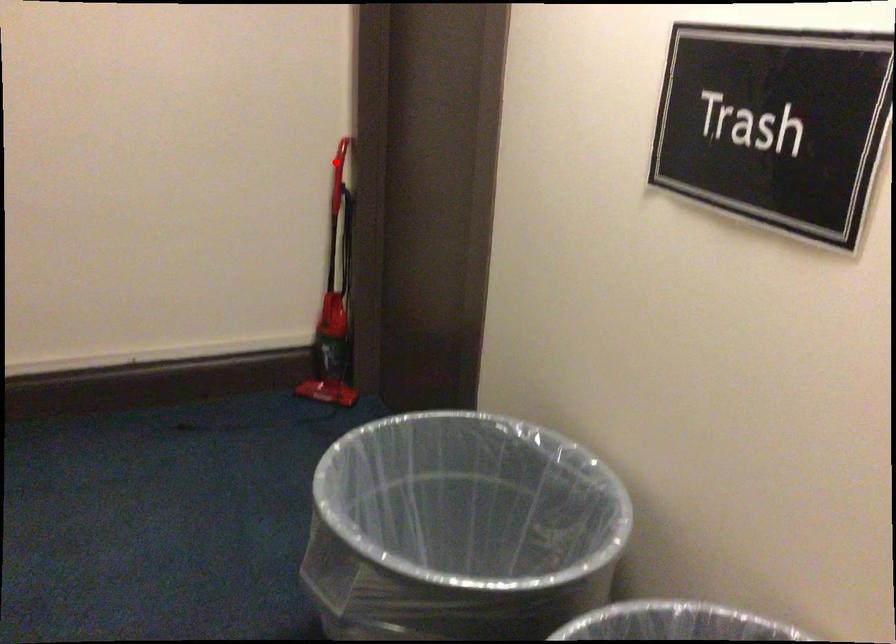
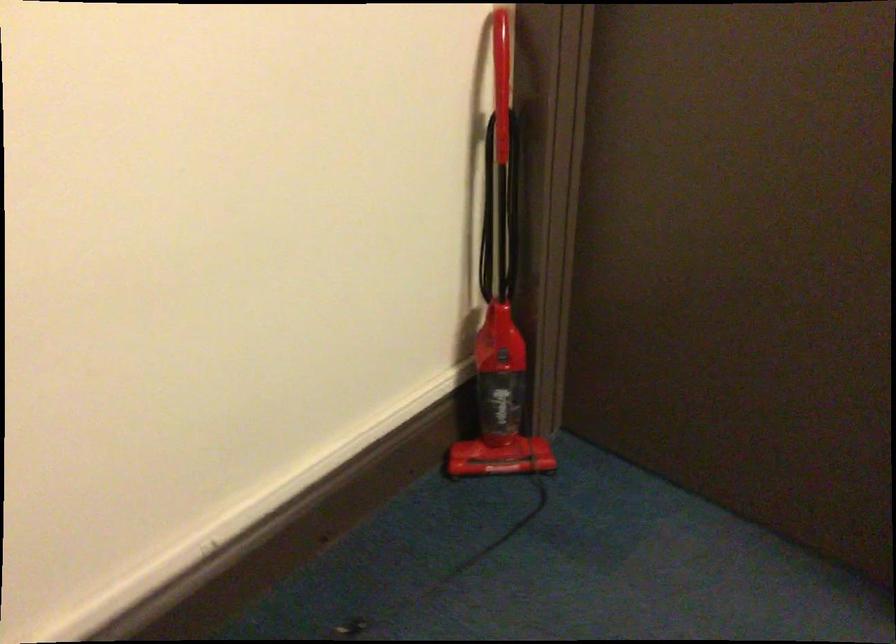
Find the pixel in the second image that matches the highlighted location in the first image.

(501, 78)